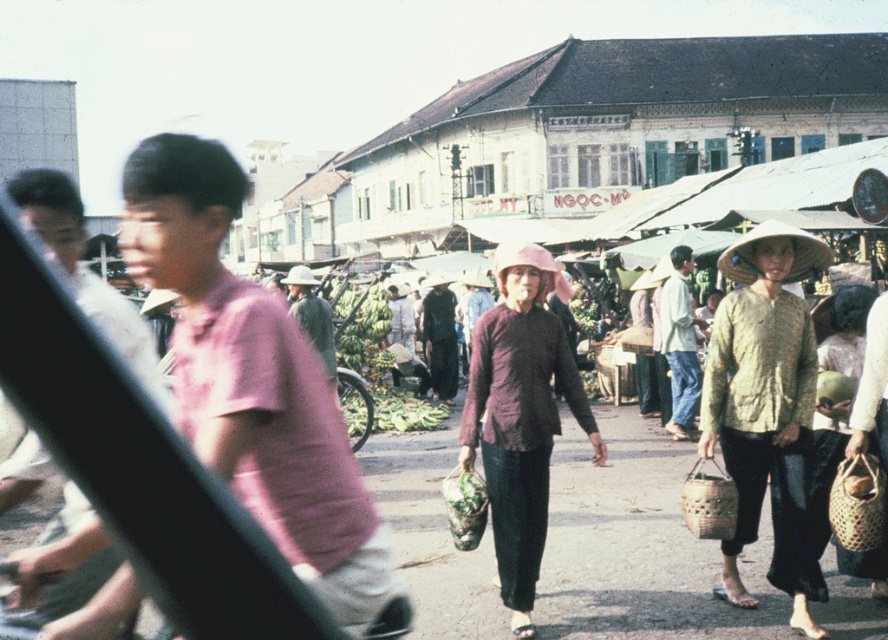
Is point (222, 291) less distant than point (781, 460)?

Yes, point (222, 291) is closer to viewer.

Does pink matte shirt at center appear on the left side of textured yellow blouse at center?

Yes, pink matte shirt at center is to the left of textured yellow blouse at center.

Which is in front, point (399, 632) or point (718, 396)?

Point (399, 632) is in front.

Find the location of a particular element. The width and height of the screenshot is (888, 640). pink matte shirt at center is located at coordinates (255, 385).

Does textured yellow blouse at center lie in front of matte purple blouse at center?

Yes, it is.

This screenshot has height=640, width=888. In order to click on textured yellow blouse at center in this screenshot , I will do `click(766, 408)`.

Is point (791, 298) positioned after point (544, 298)?

No, it is not.

The height and width of the screenshot is (640, 888). In order to click on textured yellow blouse at center in this screenshot , I will do `click(766, 408)`.

Between pink matte shirt at center and matte purple blouse at center, which one is positioned lower?

Positioned lower is matte purple blouse at center.

Does pink matte shirt at center come in front of matte purple blouse at center?

Yes.

The image size is (888, 640). In order to click on pink matte shirt at center in this screenshot , I will do `click(255, 385)`.